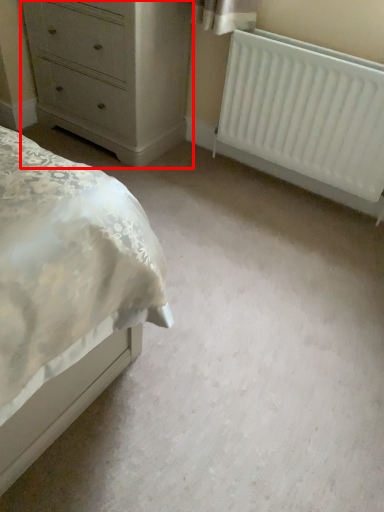
Question: From the image's perspective, where is chest of drawers (annotated by the red box) located in relation to radiator in the image?

Choices:
 (A) below
 (B) above

Answer: (B)